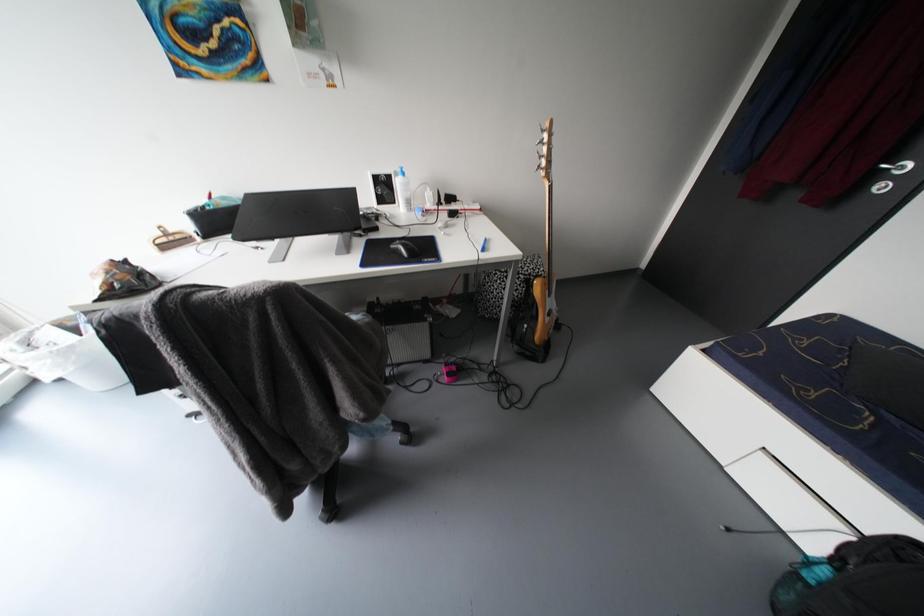
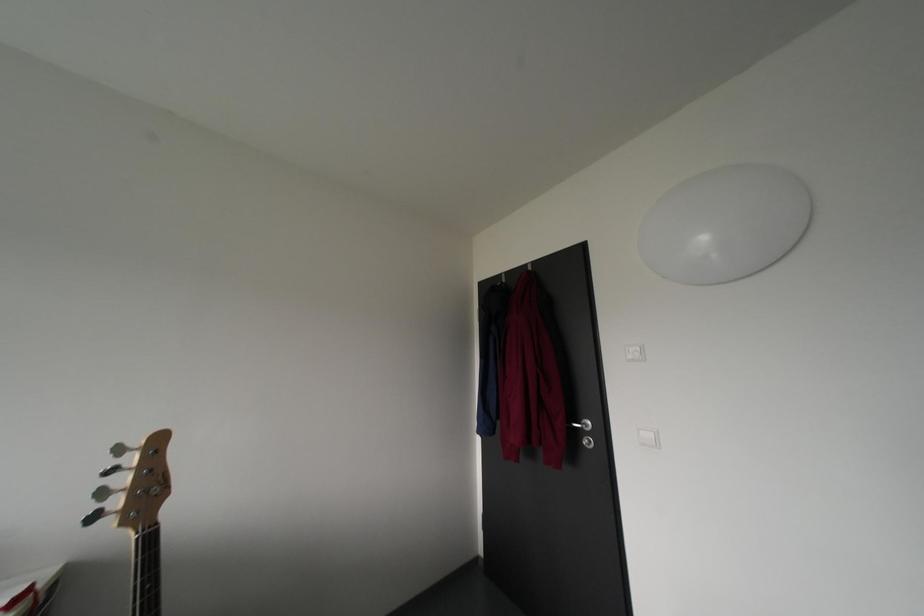
The first image is from the beginning of the video and the second image is from the end. How did the camera likely rotate when shooting the video?

The rotation direction of the camera is right-up.